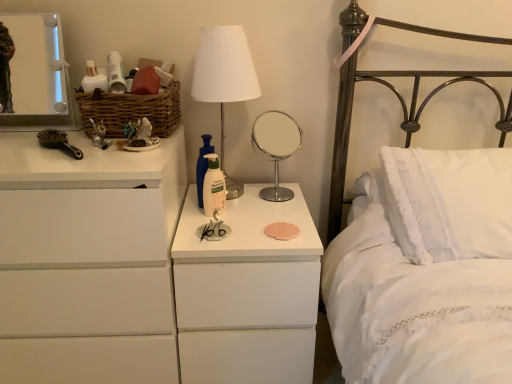
Locate an element on the screen. Image resolution: width=512 pixels, height=384 pixels. vacant area in front of metallic silver toy at left, the first toy in the left-to-right sequence is located at coordinates (92, 168).